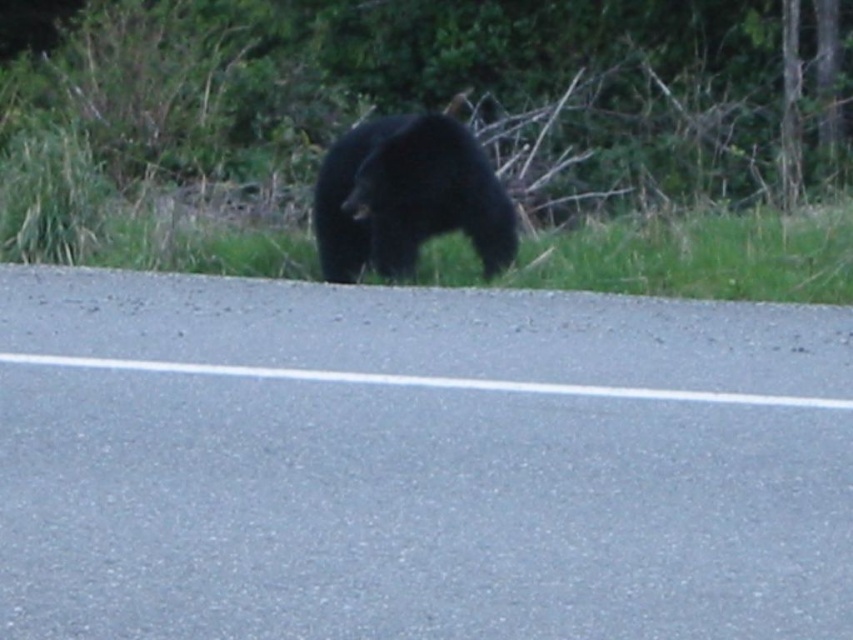
Question: Considering the relative positions of asphalt road at center and black fur bear at center in the image provided, where is asphalt road at center located with respect to black fur bear at center?

Choices:
 (A) left
 (B) right

Answer: (A)

Question: Is asphalt road at center to the right of black fur bear at center from the viewer's perspective?

Choices:
 (A) no
 (B) yes

Answer: (A)

Question: Can you confirm if asphalt road at center is positioned to the left of black fur bear at center?

Choices:
 (A) no
 (B) yes

Answer: (B)

Question: Which object is closer to the camera taking this photo?

Choices:
 (A) black fur bear at center
 (B) asphalt road at center

Answer: (B)